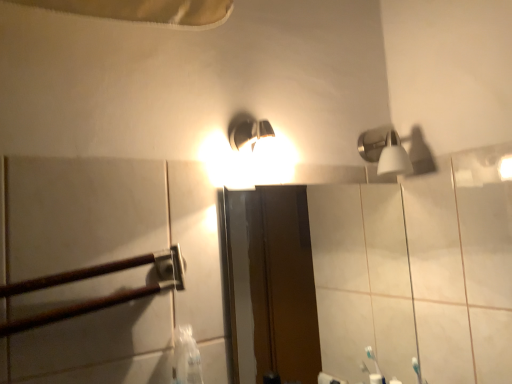
Question: Considering their positions, is satin nickel shower head at upper right located in front of or behind brown wooden rail at left?

Choices:
 (A) behind
 (B) front

Answer: (A)

Question: From a real-world perspective, is satin nickel shower head at upper right positioned above or below brown wooden rail at left?

Choices:
 (A) below
 (B) above

Answer: (B)

Question: Estimate the real-world distances between objects in this image. Which object is farther from the satin nickel shower head at upper right?

Choices:
 (A) matte glass mirror at center
 (B) brown wooden rail at left

Answer: (B)

Question: Considering the real-world distances, which object is closest to the brown wooden rail at left?

Choices:
 (A) matte glass mirror at center
 (B) satin nickel shower head at upper right

Answer: (B)